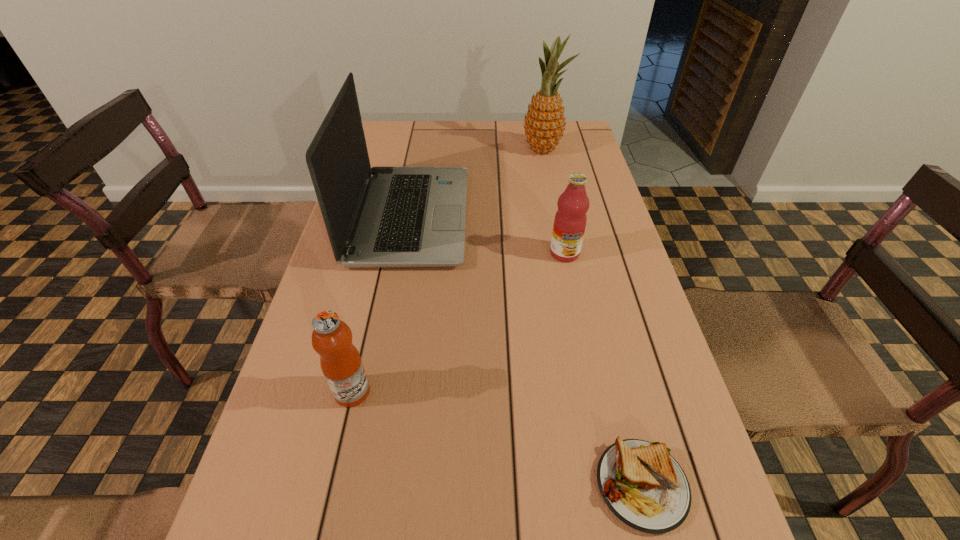
Where is `vacant region located 0.180m on the front label of the nearer fruit juice`? This screenshot has height=540, width=960. vacant region located 0.180m on the front label of the nearer fruit juice is located at coordinates (465, 392).

Find the location of `free location located 0.320m on the left of the shortest object`. free location located 0.320m on the left of the shortest object is located at coordinates (399, 485).

The image size is (960, 540). I want to click on object located in the far edge section of the desktop, so click(x=544, y=123).

Where is `laptop computer present at the left edge`? laptop computer present at the left edge is located at coordinates (381, 216).

Image resolution: width=960 pixels, height=540 pixels. What are the coordinates of `fruit juice present at the left edge` in the screenshot? It's located at (340, 361).

Identify the location of pineapple that is at the right edge. The image size is (960, 540). (544, 123).

You are a GUI agent. You are given a task and a screenshot of the screen. Output one action in this format:
    pyautogui.click(x=<x>, y=<y>)
    Task: Click on the fruit juice present at the right edge
    The height and width of the screenshot is (540, 960).
    Given the screenshot: What is the action you would take?
    pyautogui.click(x=570, y=219)

Identify the location of sandwich at the right edge. This screenshot has width=960, height=540. (642, 484).

Identify the location of object present at the far right corner. Image resolution: width=960 pixels, height=540 pixels. (544, 123).

At what (x,y) coordinates should I click in order to perform the action: click on vacant space at the far edge of the desktop. Please return your answer as a coordinate pair (x, y). Looking at the image, I should click on (423, 124).